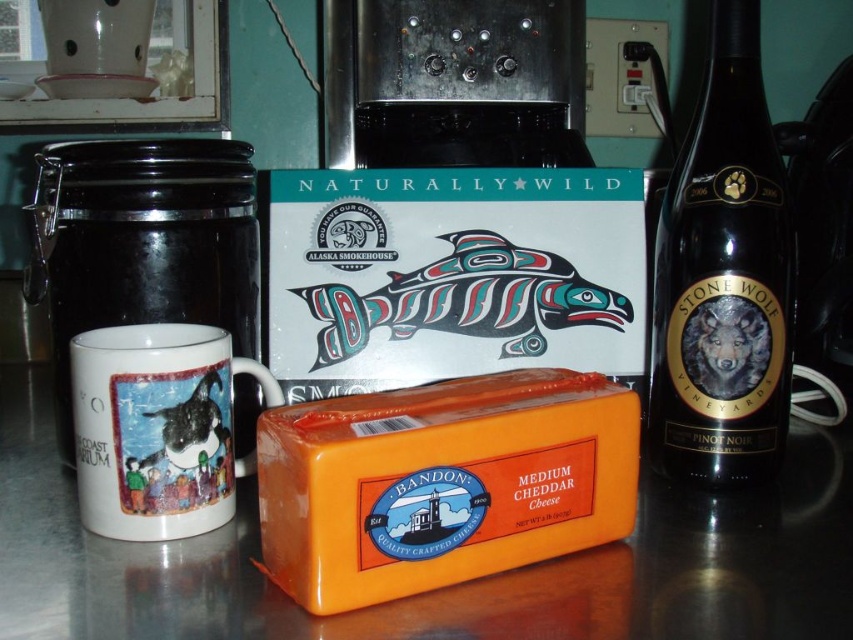
Does orange matte cheese at center have a smaller size compared to white glossy mug at left?

Yes, orange matte cheese at center is smaller than white glossy mug at left.

This screenshot has width=853, height=640. Find the location of `orange matte cheese at center`. orange matte cheese at center is located at coordinates (440, 483).

Image resolution: width=853 pixels, height=640 pixels. Find the location of `orange matte cheese at center`. orange matte cheese at center is located at coordinates (440, 483).

Is orange matte cheese at center further to the viewer compared to black glass bottle at right?

No, orange matte cheese at center is in front of black glass bottle at right.

Is orange matte cheese at center wider than black glass bottle at right?

Yes.

Find the location of `orange matte cheese at center`. orange matte cheese at center is located at coordinates (440, 483).

The height and width of the screenshot is (640, 853). Identify the location of orange plastic cheese at center. (445, 588).

The height and width of the screenshot is (640, 853). Find the location of `orange plastic cheese at center`. orange plastic cheese at center is located at coordinates (445, 588).